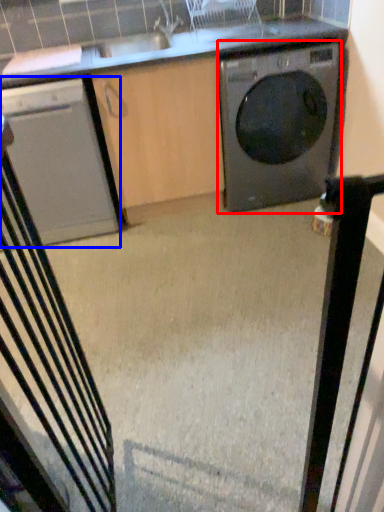
Question: Which object is closer to the camera taking this photo, washing machine (highlighted by a red box) or home appliance (highlighted by a blue box)?

Choices:
 (A) washing machine
 (B) home appliance

Answer: (B)